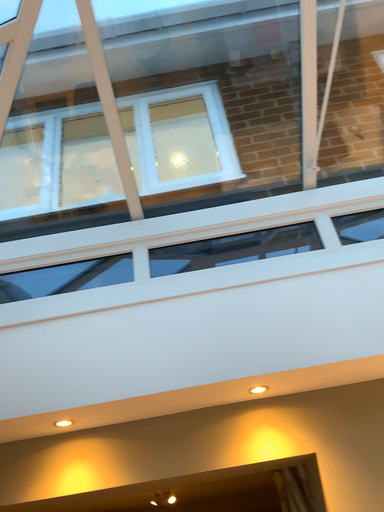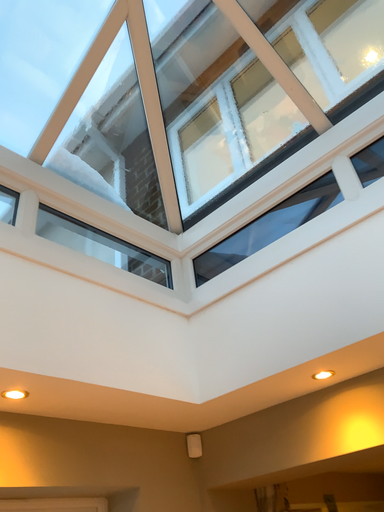
Question: Which way did the camera rotate in the video?

Choices:
 (A) rotated upward
 (B) rotated downward

Answer: (B)